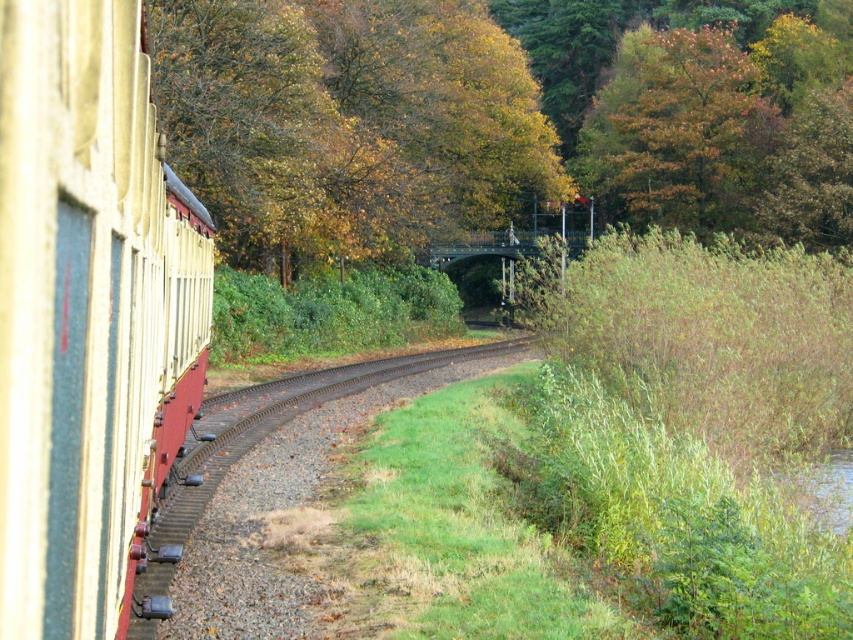
Question: Is orange-brown foliage at upper right above gravel track at center?

Choices:
 (A) no
 (B) yes

Answer: (B)

Question: Which point is farther from the camera taking this photo?

Choices:
 (A) (467, 372)
 (B) (693, 93)
 (C) (728, 108)
 (D) (57, 93)

Answer: (B)

Question: Which object is farther from the camera taking this photo?

Choices:
 (A) gravel track at center
 (B) matte cream train car at left

Answer: (A)

Question: Can you confirm if yellow-green foliage at upper center is positioned to the left of orange-brown foliage at upper right?

Choices:
 (A) no
 (B) yes

Answer: (B)

Question: Does yellow-green foliage at upper center lie in front of matte cream train car at left?

Choices:
 (A) yes
 (B) no

Answer: (B)

Question: Which point is farther to the camera?

Choices:
 (A) yellow-green foliage at upper center
 (B) orange-brown foliage at upper right
 (C) matte cream train car at left

Answer: (B)